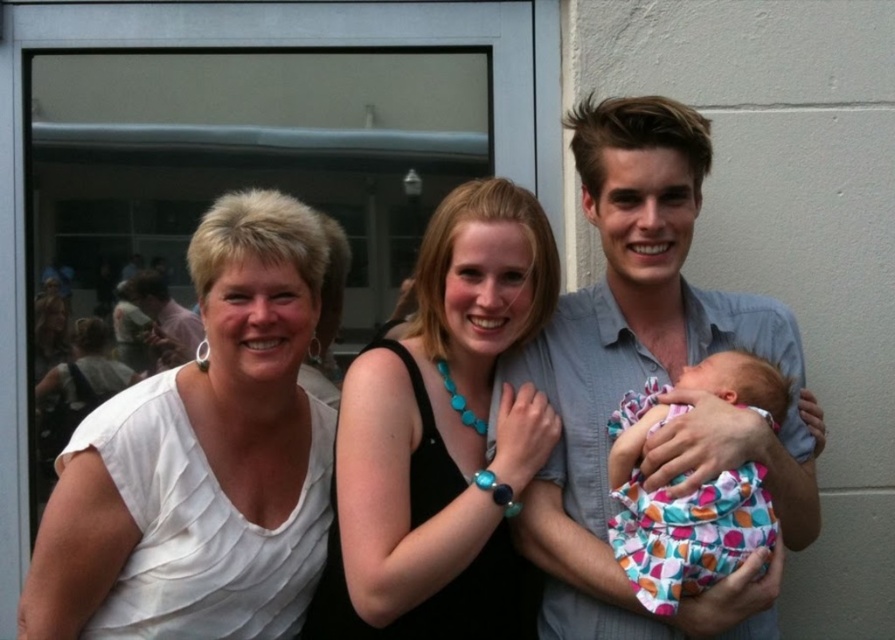
Question: Which of these objects is positioned farthest from the matte white shirt at left?

Choices:
 (A) polka dot fabric baby at center
 (B) black matte dress at center
 (C) gray cotton shirt at center
 (D) white matte shirt at left

Answer: (A)

Question: Can you confirm if black matte dress at center is bigger than matte white shirt at left?

Choices:
 (A) yes
 (B) no

Answer: (A)

Question: Is black matte dress at center further to camera compared to polka dot fabric baby at center?

Choices:
 (A) no
 (B) yes

Answer: (B)

Question: Is white matte shirt at left above polka dot fabric baby at center?

Choices:
 (A) yes
 (B) no

Answer: (A)

Question: Which object is the closest to the white matte shirt at left?

Choices:
 (A) black matte dress at center
 (B) matte white shirt at left
 (C) gray cotton shirt at center
 (D) polka dot fabric baby at center

Answer: (A)

Question: Which point is farther from the camera taking this photo?

Choices:
 (A) (226, 586)
 (B) (378, 376)

Answer: (A)